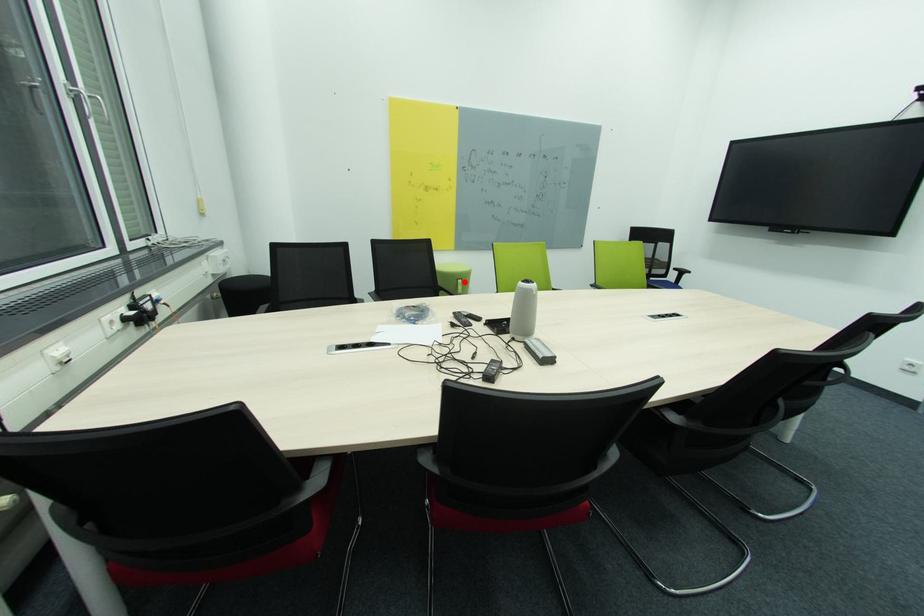
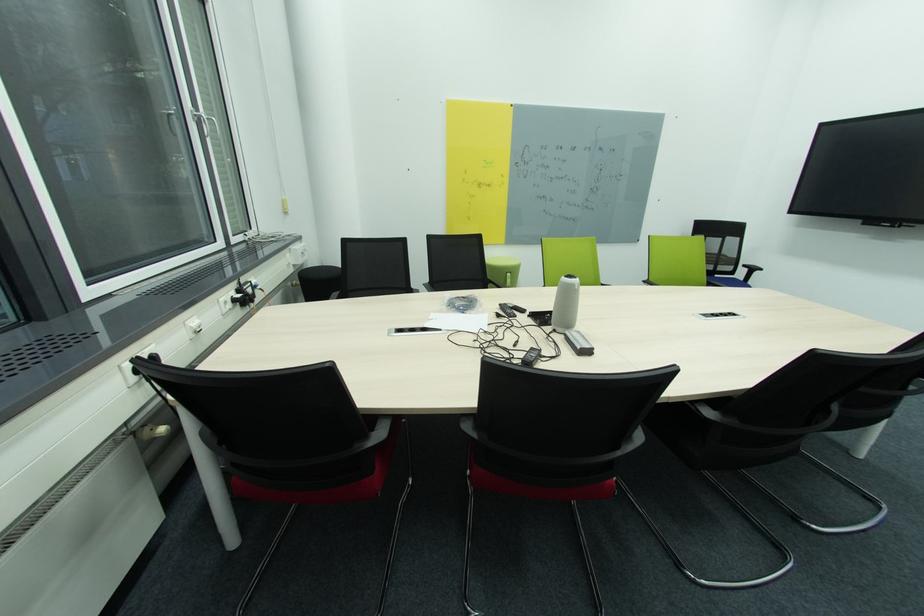
Where in the second image is the point corresponding to the highlighted location from the first image?

(514, 276)